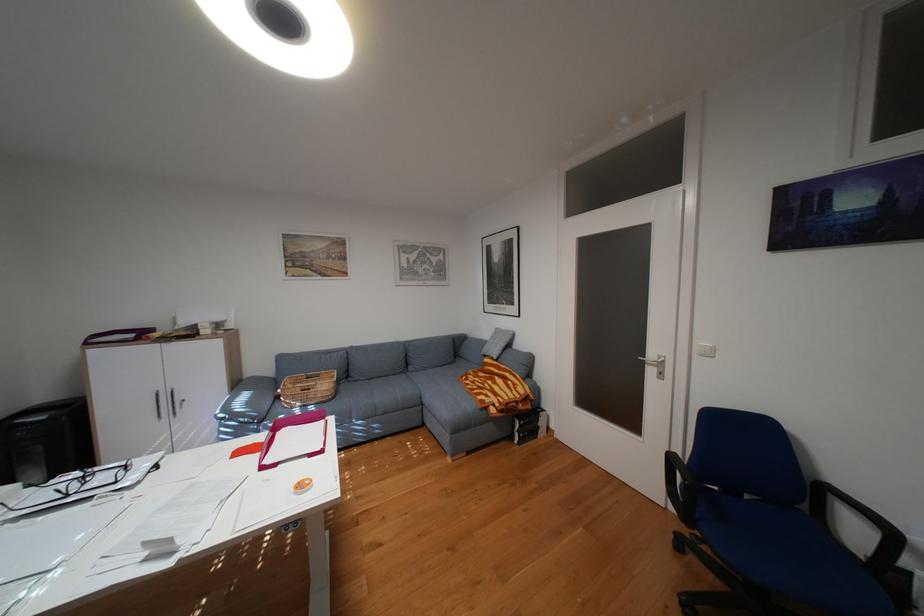
Where is `wicker basket`? wicker basket is located at coordinates (308, 387).